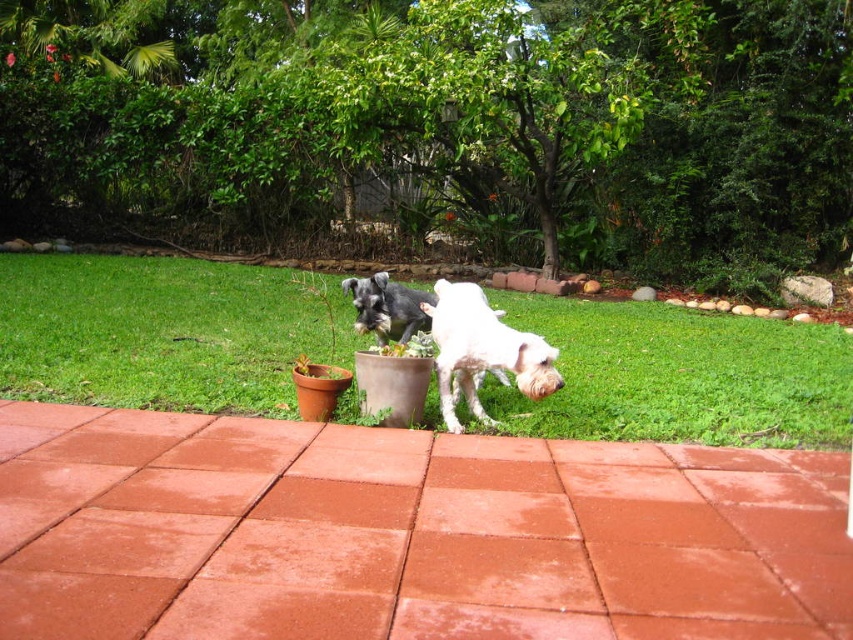
You are trying to decide where to place a new small garden ornament. You have two options for placement spots near the green grass at center and the white fur dog at center. Which location would allow the ornament to be more visible from the paved area in the foreground?

The green grass at center is wider than the white fur dog at center, so placing the ornament near the green grass at center would make it more visible from the paved area in the foreground because it has a larger space.

You are standing at the edge of the paved area and see the white fur dog at center and the shiny black dog at center. Which dog is positioned to the right of the other?

The white fur dog at center is positioned to the right of the shiny black dog at center.

You are a photographer trying to capture both the white fur dog at center and the shiny black dog at center in a single shot. Based on their positions, which dog would appear closer to the camera in your photo?

The white fur dog at center appears closer to the camera because it is positioned in front of the shiny black dog at center.